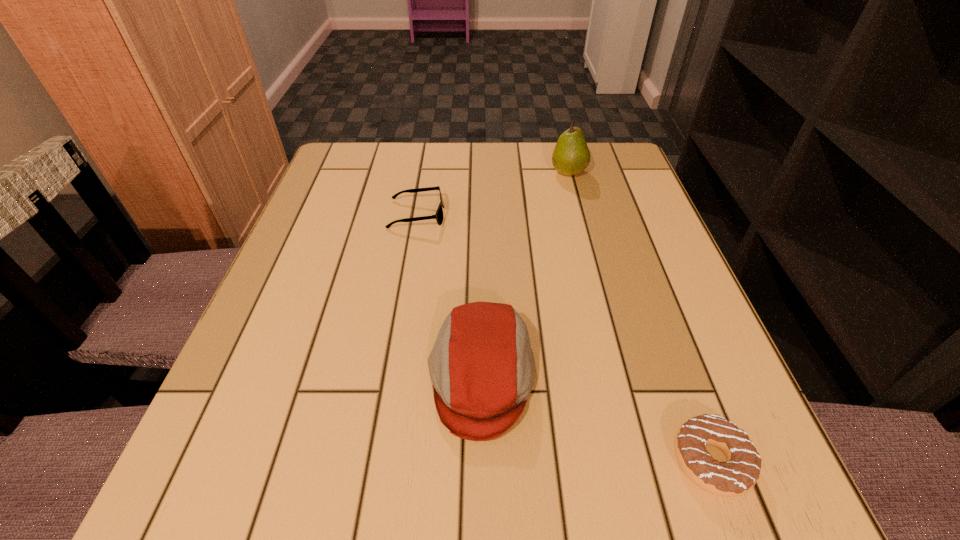
At what (x,y) coordinates should I click in order to perform the action: click on vacant position at the right edge of the desktop. Please return your answer as a coordinate pair (x, y). The width and height of the screenshot is (960, 540). Looking at the image, I should click on (659, 261).

In the image, there is a desktop. Identify the location of free space at the far left corner. The height and width of the screenshot is (540, 960). (330, 168).

Locate an element on the screen. This screenshot has height=540, width=960. blank space at the near left corner is located at coordinates (222, 475).

You are a GUI agent. You are given a task and a screenshot of the screen. Output one action in this format:
    pyautogui.click(x=<x>, y=<y>)
    Task: Click on the vacant space at the far right corner of the desktop
    
    Given the screenshot: What is the action you would take?
    pyautogui.click(x=640, y=186)

Locate an element on the screen. This screenshot has height=540, width=960. vacant area between the pear and the doughnut is located at coordinates (639, 316).

The image size is (960, 540). I want to click on vacant space in between the sunglasses and the doughnut, so click(x=564, y=338).

Locate an element on the screen. The height and width of the screenshot is (540, 960). free spot between the tallest object and the third shortest object is located at coordinates (525, 275).

This screenshot has width=960, height=540. I want to click on free area in between the second tallest object and the sunglasses, so click(x=449, y=296).

Locate an element on the screen. free space that is in between the cap and the doughnut is located at coordinates (596, 419).

Identify the location of vacant space in between the doughnut and the pear. (639, 316).